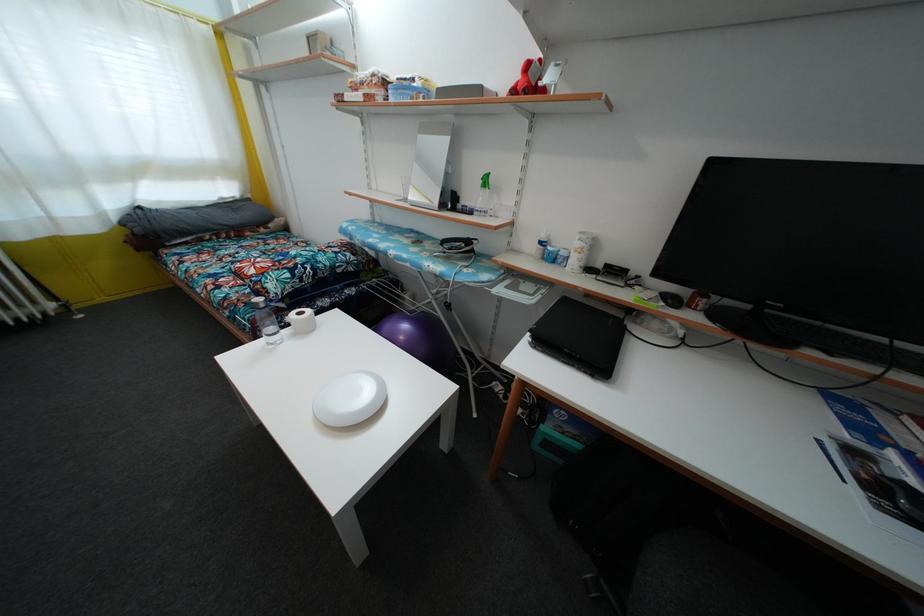
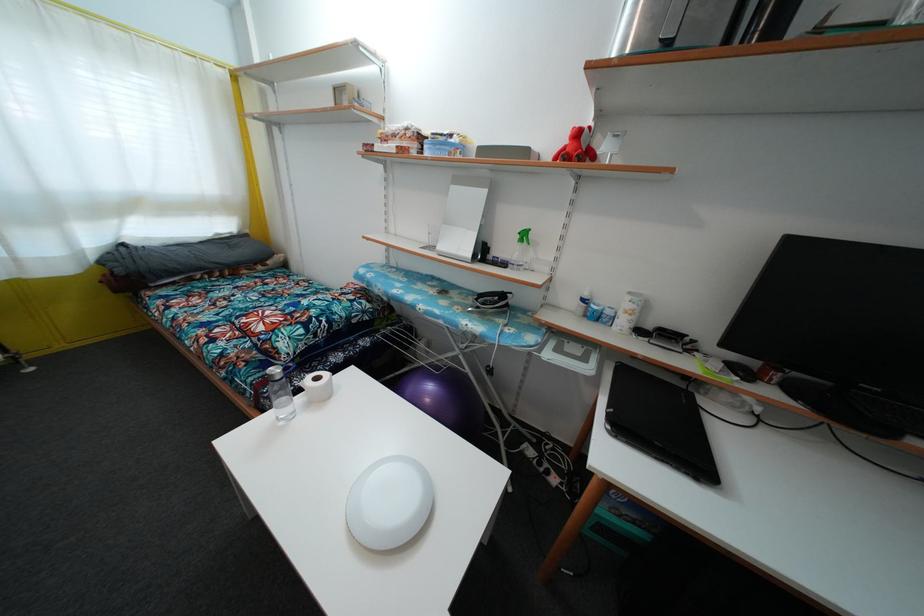
In the second image, find the point that corresponds to [265,312] in the first image.

(282, 384)